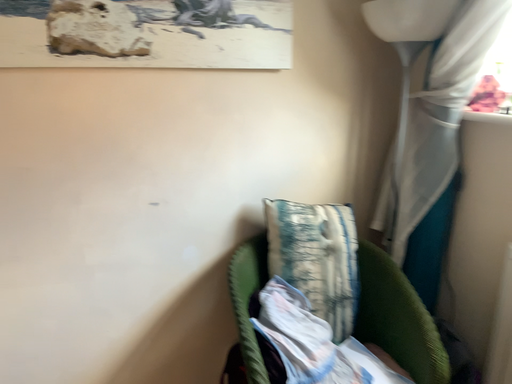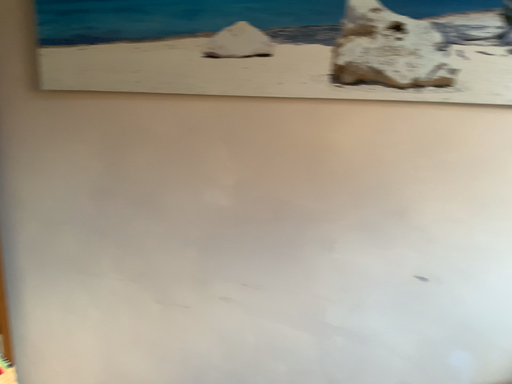
Question: How did the camera likely rotate when shooting the video?

Choices:
 (A) rotated right
 (B) rotated left

Answer: (B)